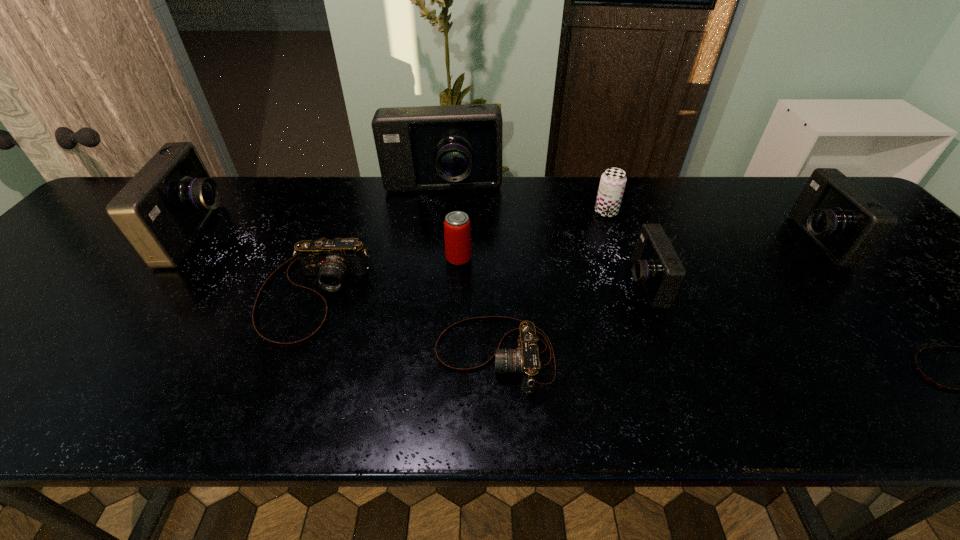
Where is `free space located 0.370m on the front-facing side of the third biggest blue camera`? free space located 0.370m on the front-facing side of the third biggest blue camera is located at coordinates (653, 241).

Find the location of `free space located on the front of the farther beer can`. free space located on the front of the farther beer can is located at coordinates (628, 274).

Identify the location of free space located 0.340m on the left of the pink beer can. This screenshot has width=960, height=540. (310, 259).

The image size is (960, 540). Identify the location of blank space located on the front-facing side of the fourth tallest camera. (500, 284).

Where is `vacant area situated on the front-facing side of the fourth tallest camera`? vacant area situated on the front-facing side of the fourth tallest camera is located at coordinates (509, 284).

This screenshot has width=960, height=540. Find the location of `free spot located on the front-facing side of the fourth tallest camera`. free spot located on the front-facing side of the fourth tallest camera is located at coordinates (556, 284).

I want to click on free space located on the front-facing side of the third shortest camera, so click(x=278, y=390).

Image resolution: width=960 pixels, height=540 pixels. In order to click on vacant space located on the front-facing side of the second biggest brown camera in this screenshot , I will do `click(277, 356)`.

Locate an element on the screen. The image size is (960, 540). vacant position located on the front-facing side of the second biggest brown camera is located at coordinates (396, 356).

The image size is (960, 540). I want to click on free location located on the front-facing side of the second biggest brown camera, so click(x=361, y=356).